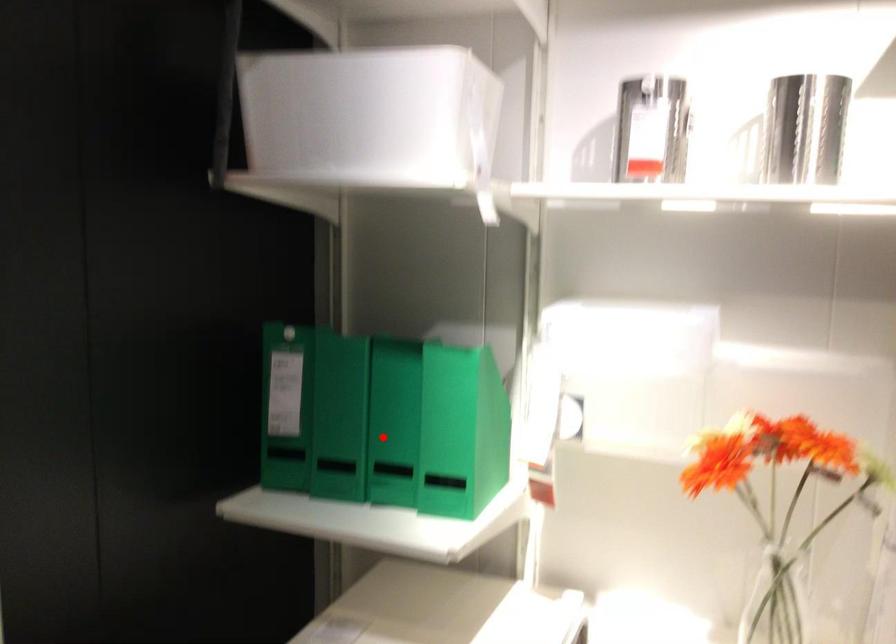
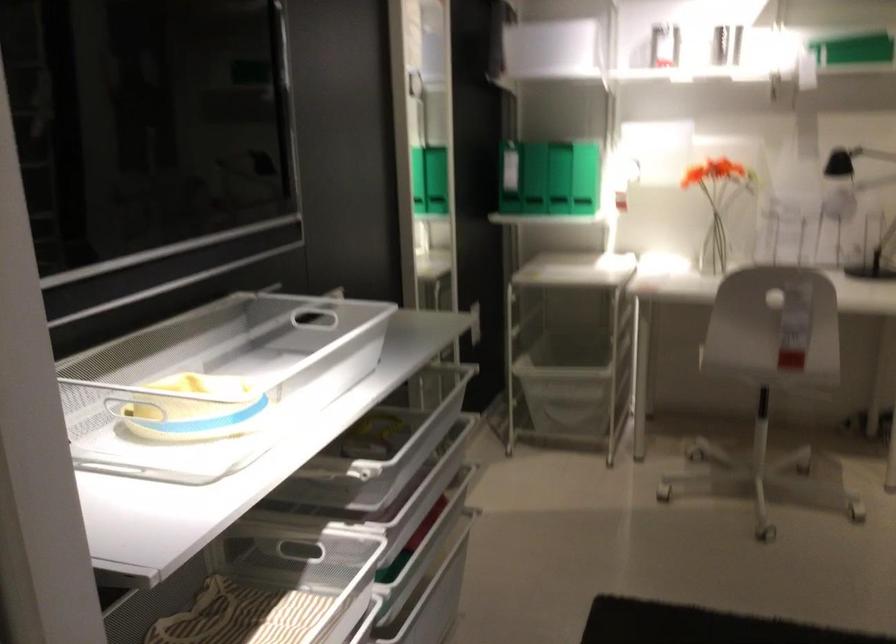
Question: I am providing you with two images of the same scene from different viewpoints. A red point is shown in image1. For the corresponding object point in image2, is it positioned nearer or farther from the camera?

Choices:
 (A) Nearer
 (B) Farther

Answer: (B)